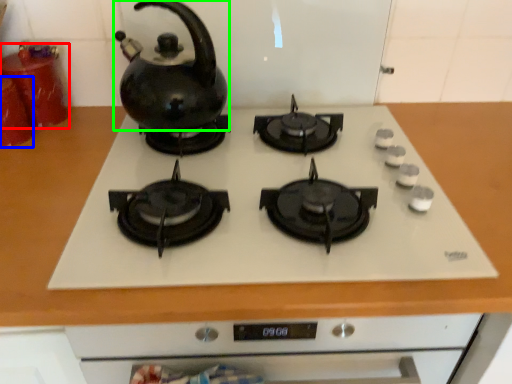
Question: Which is farther away from kitchen appliance (highlighted by a red box)? kitchen appliance (highlighted by a blue box) or kettle (highlighted by a green box)?

Choices:
 (A) kitchen appliance
 (B) kettle

Answer: (B)